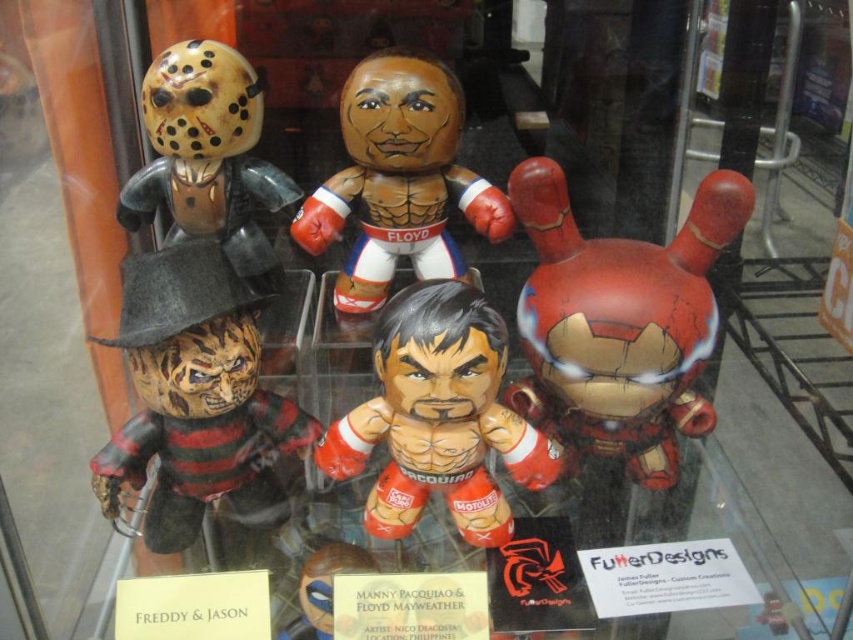
Based on the coordinates provided, where is the wooden freddy krueger figure at left located in the glass case?

The wooden freddy krueger figure at left is located at the coordinates point [196,397] in the glass case.

You are a collector who wants to display the cracked metallic iron man at right and the matte black helmet at upper left on a shelf. Which one should you place first if you want to follow the size order from largest to smallest?

The matte black helmet at upper left is larger than the cracked metallic iron man at right, so you should place the matte black helmet at upper left first to follow the size order from largest to smallest.